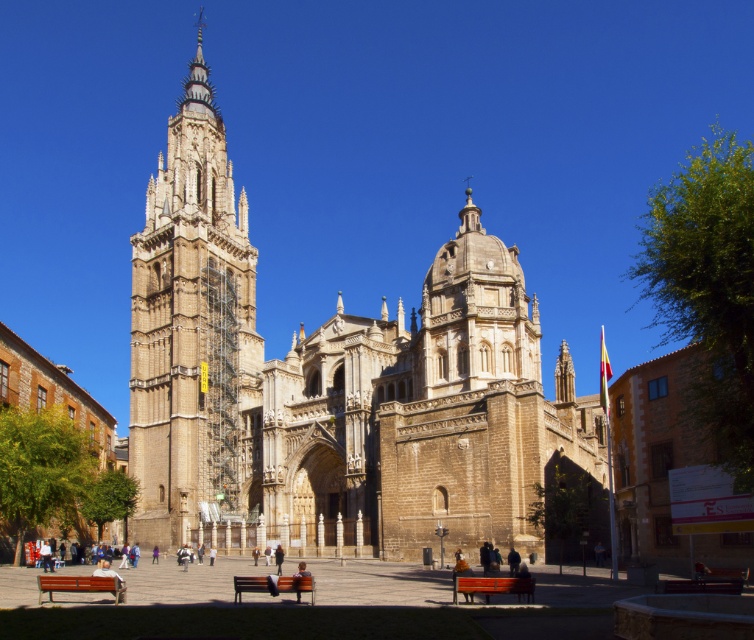
Question: Does wooden bench at lower center lie behind brown leather jacket at center?

Choices:
 (A) yes
 (B) no

Answer: (B)

Question: Which point is closer to the camera?

Choices:
 (A) (280, 560)
 (B) (97, 566)
 (C) (149, 288)

Answer: (A)

Question: Does brown stone church at center have a smaller size compared to wooden bench at lower center?

Choices:
 (A) yes
 (B) no

Answer: (B)

Question: Which of the following is the farthest from the observer?

Choices:
 (A) (455, 572)
 (B) (118, 579)

Answer: (A)

Question: Can you confirm if brown stone church at center is positioned above black fabric person at center?

Choices:
 (A) no
 (B) yes

Answer: (B)

Question: Which point is closer to the camera?

Choices:
 (A) brown leather jacket at center
 (B) light brown wooden bench at lower center

Answer: (A)